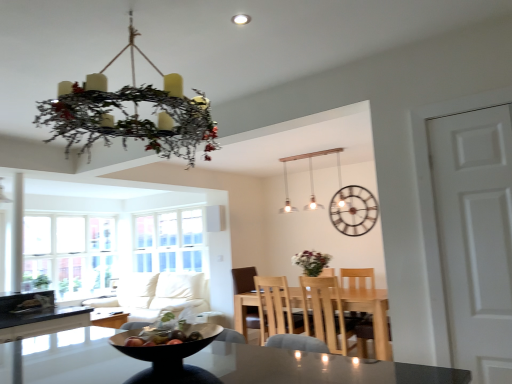
Question: Is point (369, 307) positioned closer to the camera than point (372, 201)?

Choices:
 (A) farther
 (B) closer

Answer: (B)

Question: Visually, is light wood table at center positioned to the left or to the right of metallic clock at upper center?

Choices:
 (A) right
 (B) left

Answer: (B)

Question: Estimate the real-world distances between objects in this image. Which object is farther from the matte wooden table at center?

Choices:
 (A) clear glass window at left
 (B) white matte door at right
 (C) matte white pendant lights at upper center
 (D) light wood chair at center
 (E) shiny plastic bowl at center

Answer: (C)

Question: Which of these objects is positioned farthest from the light wood chair at center?

Choices:
 (A) matte wooden table at center
 (B) white fabric couch at lower left
 (C) light wood table at center
 (D) matte white pendant lights at upper center
 (E) white glass window screen at left

Answer: (A)